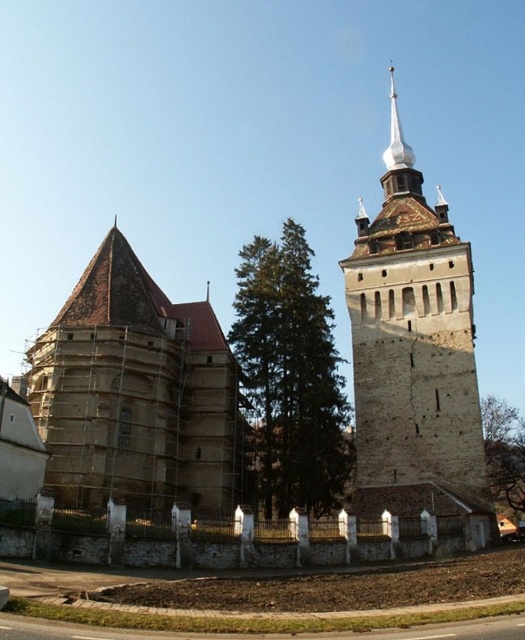
Between brown wooden church at center and green leafy tree at lower right, which one is positioned higher?

brown wooden church at center

Is brown wooden church at center thinner than green leafy tree at lower right?

No, brown wooden church at center is not thinner than green leafy tree at lower right.

In the scene shown: Who is more forward, (225, 392) or (509, 508)?

Positioned in front is point (225, 392).

You are a GUI agent. You are given a task and a screenshot of the screen. Output one action in this format:
    pyautogui.click(x=<x>, y=<y>)
    Task: Click on the brown wooden church at center
    
    Given the screenshot: What is the action you would take?
    pyautogui.click(x=138, y=394)

The height and width of the screenshot is (640, 525). Describe the element at coordinates (290, 378) in the screenshot. I see `green textured tree at center` at that location.

Between point (253, 444) and point (487, 440), which one is positioned behind?

The point (487, 440) is more distant.

The height and width of the screenshot is (640, 525). Find the location of `green textured tree at center`. green textured tree at center is located at coordinates (290, 378).

Which is behind, point (128, 385) or point (386, 156)?

The point (386, 156) is behind.

Find the location of `brown wooden church at center`. brown wooden church at center is located at coordinates tap(138, 394).